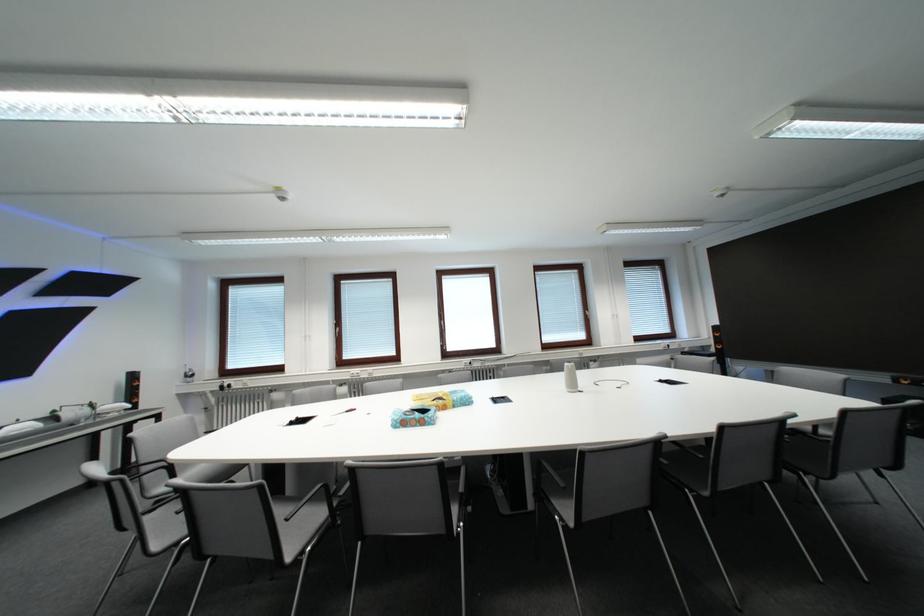
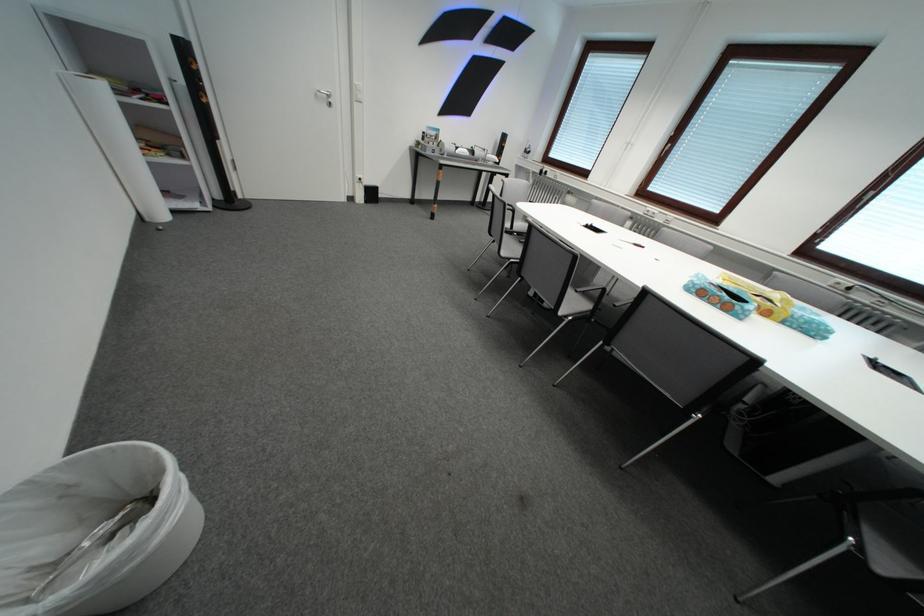
The point at (370, 545) is marked in the first image. Where is the corresponding point in the second image?

(611, 346)